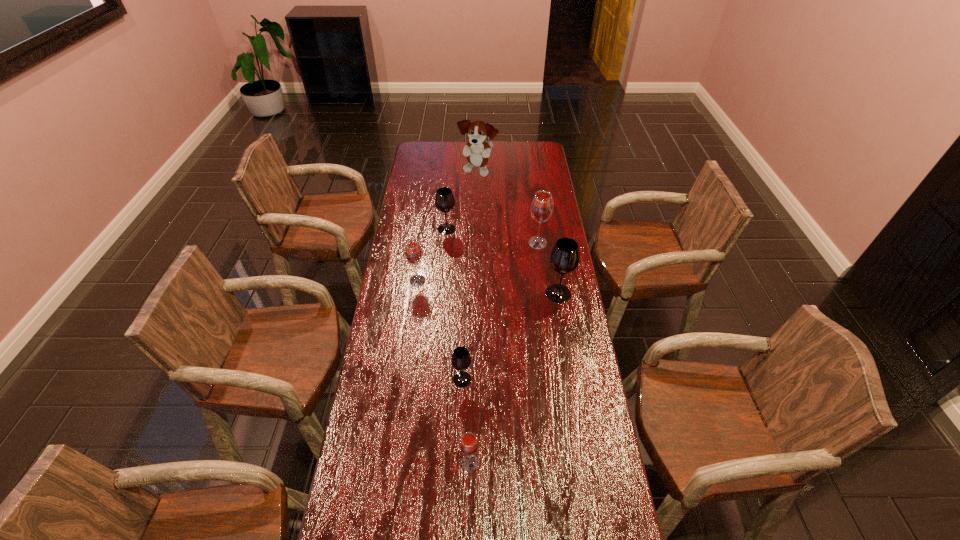
Image resolution: width=960 pixels, height=540 pixels. Identify the location of vacant position located on the back of the smallest gray wineglass. (466, 288).

Where is `object at the far edge`? object at the far edge is located at coordinates (477, 150).

Where is `object that is at the left edge`? This screenshot has width=960, height=540. object that is at the left edge is located at coordinates (413, 252).

Image resolution: width=960 pixels, height=540 pixels. In order to click on vacant space at the far edge of the desktop in this screenshot , I will do `click(452, 156)`.

Find the location of `vacant space at the left edge of the desktop`. vacant space at the left edge of the desktop is located at coordinates (427, 168).

I want to click on vacant space at the right edge of the desktop, so click(550, 310).

Image resolution: width=960 pixels, height=540 pixels. I want to click on empty location between the leftmost wineglass and the nearest object, so click(x=444, y=372).

The width and height of the screenshot is (960, 540). Identify the location of vacant area that lies between the farthest object and the nearest wineglass. (474, 318).

Where is `blank region between the second nearest gray wineglass and the farthest red wineglass`? blank region between the second nearest gray wineglass and the farthest red wineglass is located at coordinates (548, 268).

You are a GUI agent. You are given a task and a screenshot of the screen. Output one action in this format:
    pyautogui.click(x=<x>, y=<y>)
    Task: Click on the empty space between the brown puppy and the second nearest object
    This screenshot has width=960, height=540.
    Given the screenshot: What is the action you would take?
    pyautogui.click(x=470, y=276)